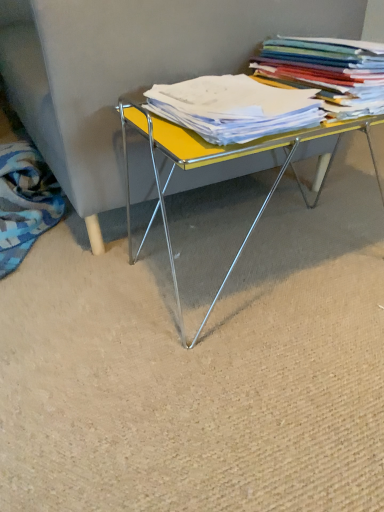
Question: Is the surface of blue patterned fabric at lower left in direct contact with multicolored paper stack at upper right?

Choices:
 (A) no
 (B) yes

Answer: (A)

Question: Is blue patterned fabric at lower left oriented away from multicolored paper stack at upper right?

Choices:
 (A) yes
 (B) no

Answer: (B)

Question: Does blue patterned fabric at lower left have a greater height compared to multicolored paper stack at upper right?

Choices:
 (A) yes
 (B) no

Answer: (A)

Question: Considering the relative sizes of blue patterned fabric at lower left and multicolored paper stack at upper right in the image provided, is blue patterned fabric at lower left thinner than multicolored paper stack at upper right?

Choices:
 (A) no
 (B) yes

Answer: (A)

Question: Would you say blue patterned fabric at lower left contains multicolored paper stack at upper right?

Choices:
 (A) yes
 (B) no

Answer: (B)

Question: Is blue patterned fabric at lower left in front of or behind multicolored paper stack at upper right in the image?

Choices:
 (A) front
 (B) behind

Answer: (B)

Question: From a real-world perspective, is blue patterned fabric at lower left physically located above or below multicolored paper stack at upper right?

Choices:
 (A) below
 (B) above

Answer: (A)

Question: Considering the relative positions of blue patterned fabric at lower left and multicolored paper stack at upper right in the image provided, is blue patterned fabric at lower left to the left or to the right of multicolored paper stack at upper right?

Choices:
 (A) right
 (B) left

Answer: (B)

Question: Based on their sizes in the image, would you say blue patterned fabric at lower left is bigger or smaller than multicolored paper stack at upper right?

Choices:
 (A) small
 (B) big

Answer: (B)

Question: Does point (266, 148) appear closer or farther from the camera than point (254, 62)?

Choices:
 (A) closer
 (B) farther

Answer: (A)

Question: From a real-world perspective, is yellow glossy table at center above or below multicolored paper stack at upper right?

Choices:
 (A) above
 (B) below

Answer: (B)

Question: Is yellow glossy table at center spatially inside multicolored paper stack at upper right, or outside of it?

Choices:
 (A) inside
 (B) outside

Answer: (B)

Question: Is yellow glossy table at center to the left or to the right of multicolored paper stack at upper right in the image?

Choices:
 (A) left
 (B) right

Answer: (A)

Question: Relative to yellow matte paper at center, is multicolored paper stack at upper right in front or behind?

Choices:
 (A) front
 (B) behind

Answer: (B)

Question: From the image's perspective, is multicolored paper stack at upper right above or below yellow matte paper at center?

Choices:
 (A) below
 (B) above

Answer: (B)